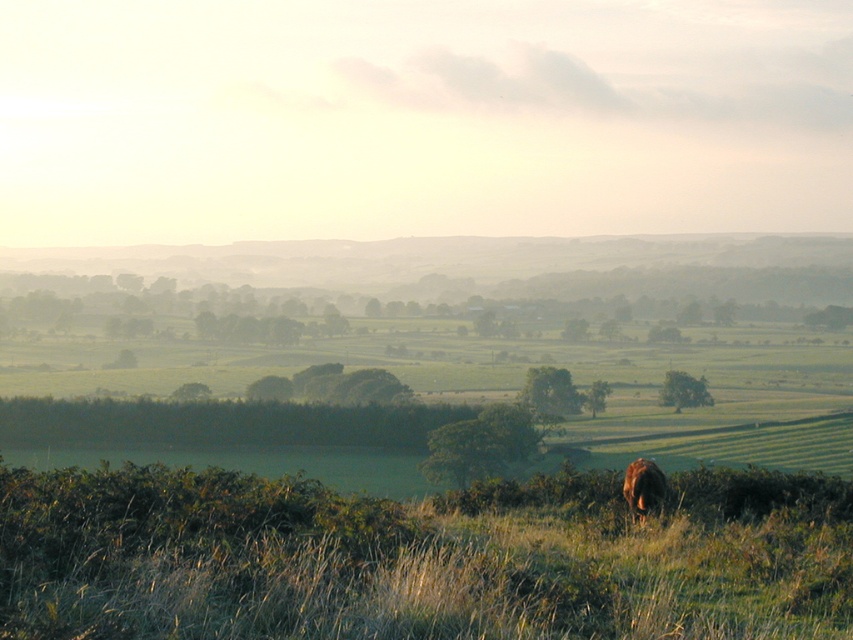
Question: Among these points, which one is farthest from the camera?

Choices:
 (A) (367, 550)
 (B) (657, 493)

Answer: (B)

Question: Among these points, which one is nearest to the camera?

Choices:
 (A) (642, 509)
 (B) (155, 486)

Answer: (B)

Question: Is green grassy at lower center to the right of brown furry animal at lower center from the viewer's perspective?

Choices:
 (A) yes
 (B) no

Answer: (B)

Question: Which point is closer to the camera taking this photo?

Choices:
 (A) (776, 602)
 (B) (654, 477)

Answer: (A)

Question: Considering the relative positions of green grassy at lower center and brown furry animal at lower center in the image provided, where is green grassy at lower center located with respect to brown furry animal at lower center?

Choices:
 (A) above
 (B) below

Answer: (A)

Question: Does green grassy at lower center lie behind brown furry animal at lower center?

Choices:
 (A) no
 (B) yes

Answer: (A)